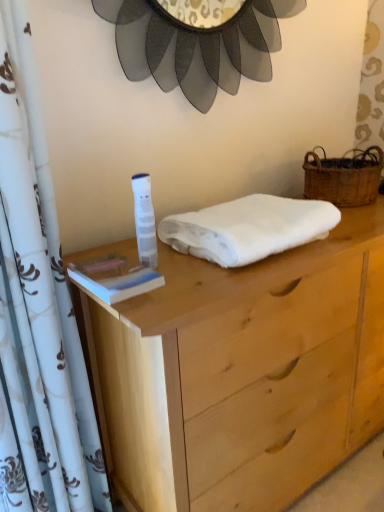
Locate an element on the screen. Image resolution: width=384 pixels, height=512 pixels. vacant space that is in between white plastic tube at center and white soft towel at center is located at coordinates (182, 263).